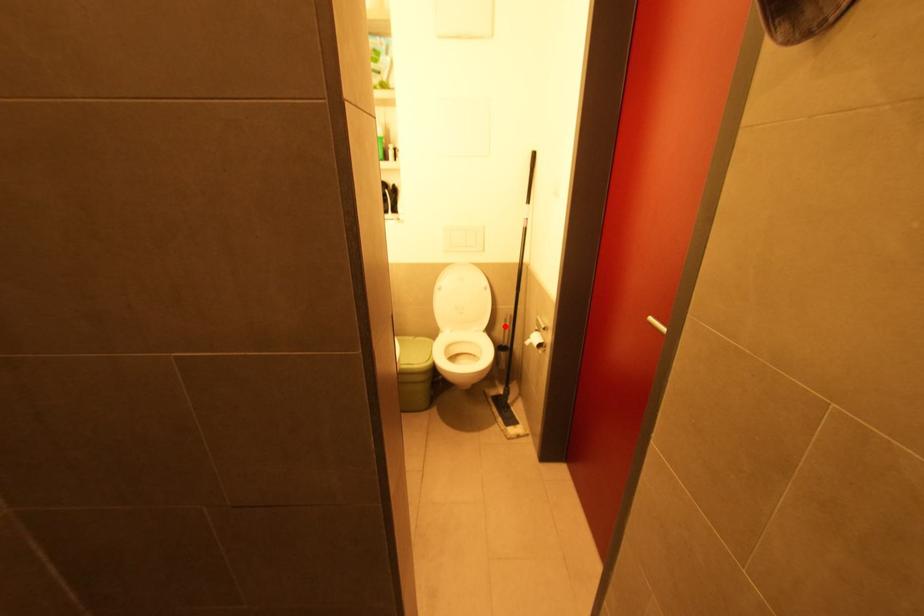
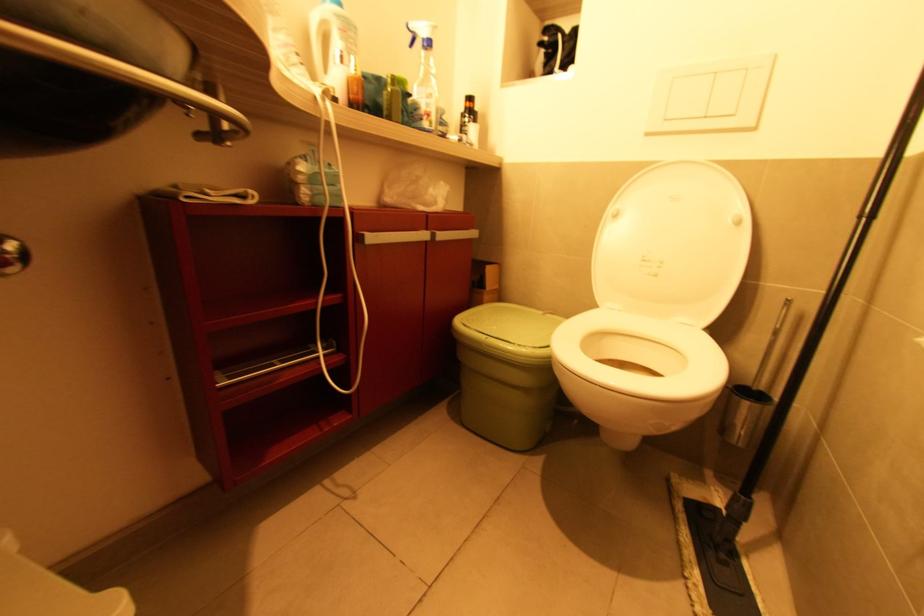
Question: I am providing you with two images of the same scene from different viewpoints. In image1, a red point is highlighted. Considering the same 3D point in image2, which of the following is correct?

Choices:
 (A) It is closer
 (B) It is farther

Answer: (A)